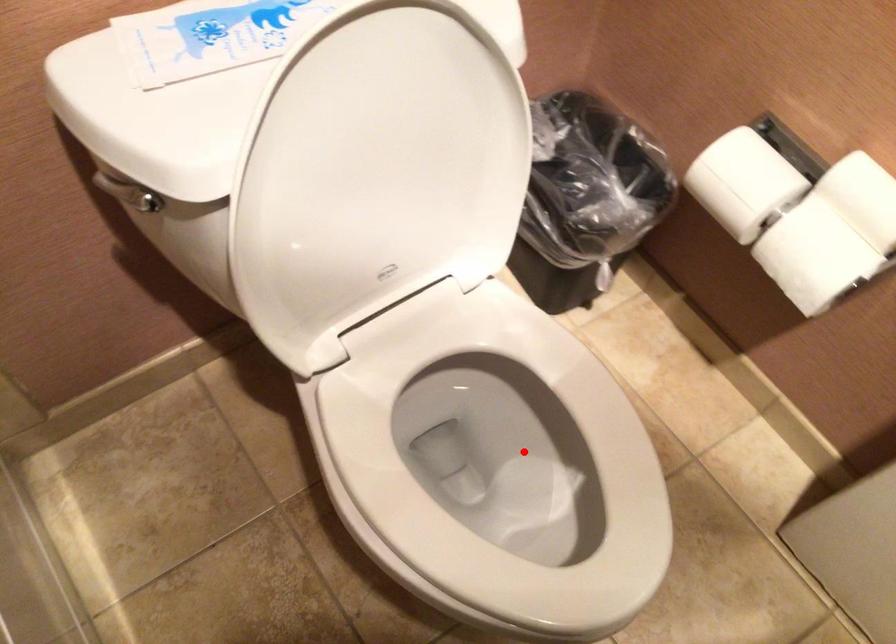
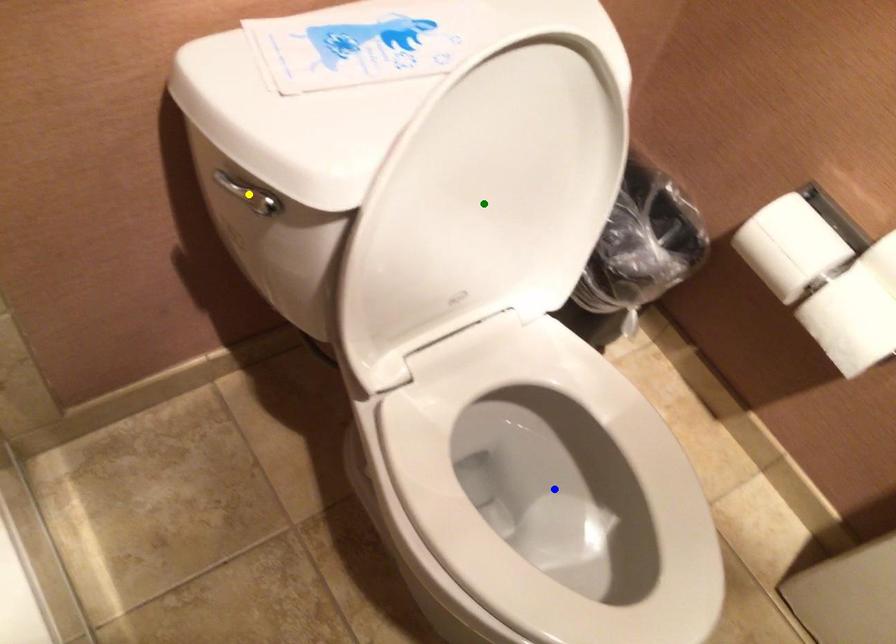
Question: I am providing you with two images of the same scene from different viewpoints. A red point is marked on the first image. You are given multiple points on the second image. Which mark in image 2 goes with the point in image 1?

Choices:
 (A) green point
 (B) blue point
 (C) yellow point

Answer: (B)